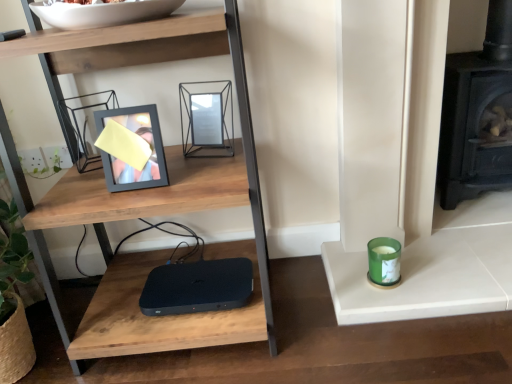
The width and height of the screenshot is (512, 384). I want to click on free space in front of green glass candle at right, so click(x=407, y=337).